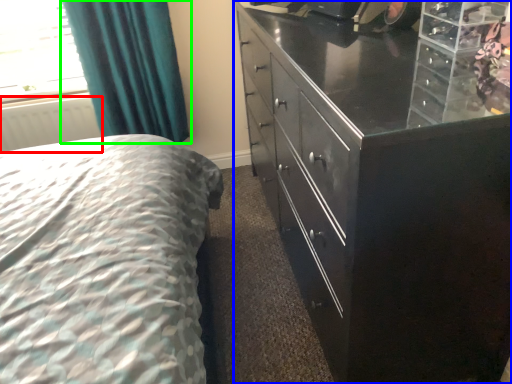
Question: Estimate the real-world distances between objects in this image. Which object is farther from radiator (highlighted by a red box), chest of drawers (highlighted by a blue box) or curtain (highlighted by a green box)?

Choices:
 (A) chest of drawers
 (B) curtain

Answer: (A)